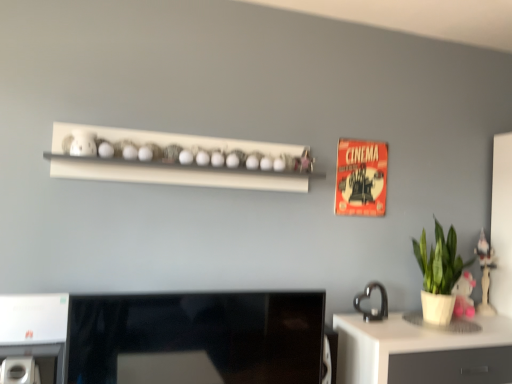
Question: Does white glossy shelf at upper center lie in front of green matte plant at right?

Choices:
 (A) no
 (B) yes

Answer: (B)

Question: Can you confirm if white glossy shelf at upper center is shorter than green matte plant at right?

Choices:
 (A) yes
 (B) no

Answer: (A)

Question: From the image's perspective, is white glossy shelf at upper center over green matte plant at right?

Choices:
 (A) yes
 (B) no

Answer: (A)

Question: Does white glossy shelf at upper center have a smaller size compared to green matte plant at right?

Choices:
 (A) yes
 (B) no

Answer: (B)

Question: Is white glossy shelf at upper center in contact with green matte plant at right?

Choices:
 (A) yes
 (B) no

Answer: (B)

Question: From the image's perspective, does white glossy shelf at upper center appear lower than green matte plant at right?

Choices:
 (A) yes
 (B) no

Answer: (B)

Question: Would you say white glossy shelf at upper center is outside black glossy desktop at center?

Choices:
 (A) yes
 (B) no

Answer: (A)

Question: Can you confirm if white glossy shelf at upper center is thinner than black glossy desktop at center?

Choices:
 (A) yes
 (B) no

Answer: (B)

Question: Is the depth of white glossy shelf at upper center greater than that of black glossy desktop at center?

Choices:
 (A) no
 (B) yes

Answer: (B)

Question: Does white glossy shelf at upper center appear on the right side of black glossy desktop at center?

Choices:
 (A) yes
 (B) no

Answer: (B)

Question: Is white glossy shelf at upper center facing away from black glossy desktop at center?

Choices:
 (A) no
 (B) yes

Answer: (A)

Question: Is white glossy shelf at upper center wider than black glossy desktop at center?

Choices:
 (A) yes
 (B) no

Answer: (A)

Question: Is wooden figurine at right not close to white glossy desk at lower right?

Choices:
 (A) yes
 (B) no

Answer: (B)